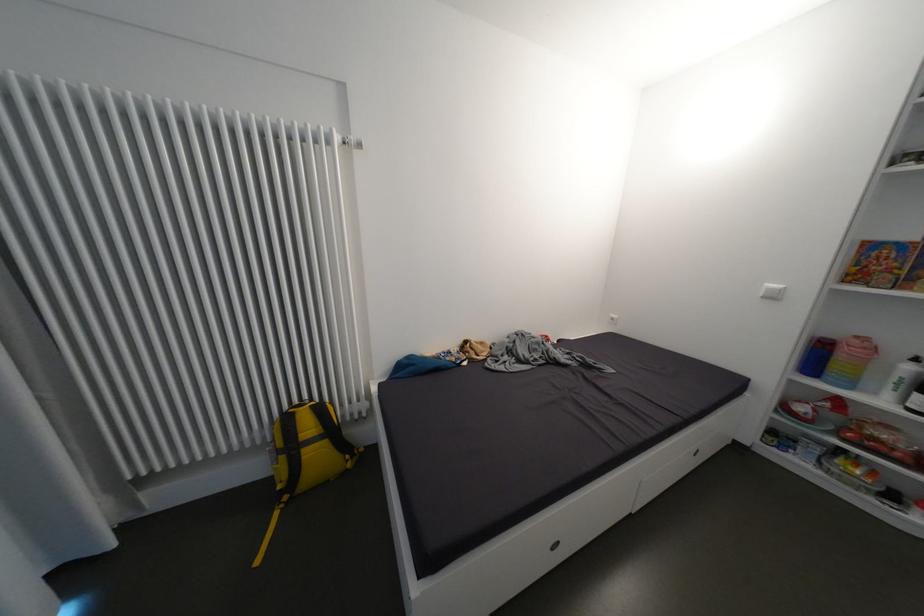
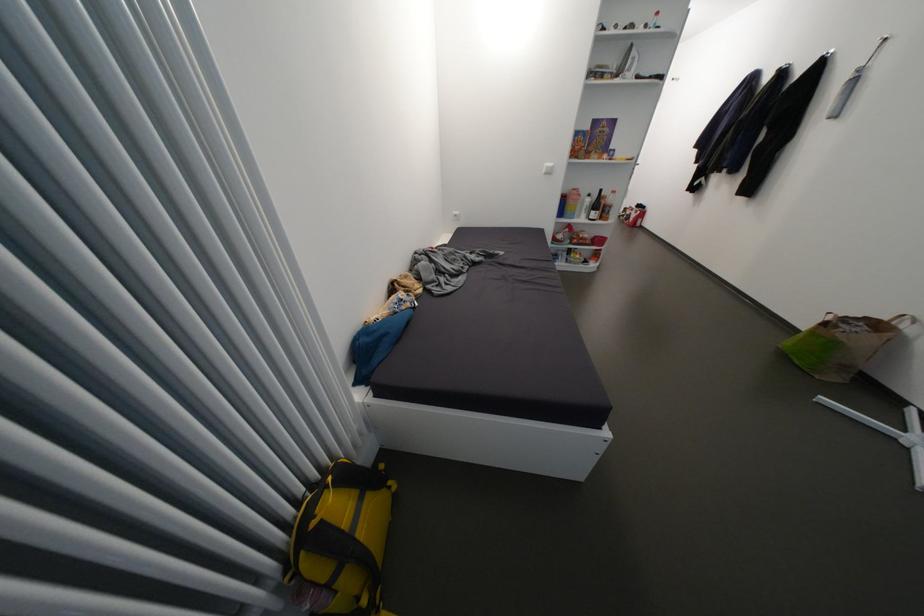
Find the pixel in the second image that matches point 314,453 in the first image.

(370, 533)